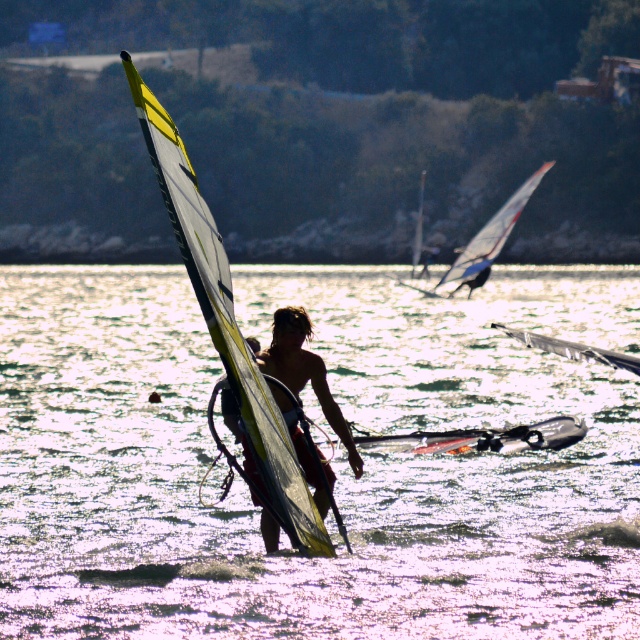
Is yellow and white sail at center in front of white glossy surfboard at center?

Yes, it is in front of white glossy surfboard at center.

Is yellow and white sail at center above white glossy surfboard at center?

Yes.

Does point (221, 355) come behind point (499, 444)?

No, it is in front of (499, 444).

You are a GUI agent. You are given a task and a screenshot of the screen. Output one action in this format:
    pyautogui.click(x=<x>, y=<y>)
    Task: Click on the yellow and white sail at center
    This screenshot has width=640, height=640.
    Given the screenshot: What is the action you would take?
    pyautogui.click(x=227, y=326)

Does point (236, 326) lie in front of point (339, 420)?

That is True.

Is the position of yellow and white sail at center more distant than that of shiny silver surfboard at center?

No, yellow and white sail at center is in front of shiny silver surfboard at center.

Which is in front, point (272, 419) or point (289, 308)?

Point (272, 419) is more forward.

Locate an element on the screen. This screenshot has width=640, height=640. yellow and white sail at center is located at coordinates (227, 326).

Can you confirm if translucent plastic water at center is positioned to the left of yellow and white sail at center?

Incorrect, translucent plastic water at center is not on the left side of yellow and white sail at center.

Is point (330, 346) in front of point (204, 289)?

No, (330, 346) is further to viewer.

Between point (627, 528) and point (250, 440), which one is positioned in front?

Point (250, 440) is more forward.

The image size is (640, 640). Find the location of `translucent plastic water at center`. translucent plastic water at center is located at coordinates (332, 465).